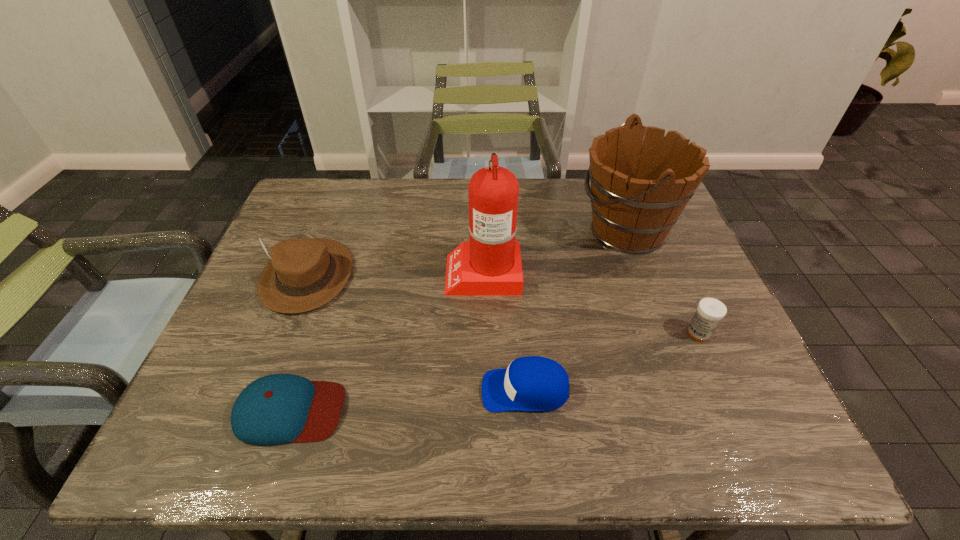
Locate an element on the screen. vacant space located 0.370m on the front-facing side of the fire extinguisher is located at coordinates (307, 272).

Find the location of a particular element. This screenshot has width=960, height=540. vacant space located 0.360m with the handle on the fifth shortest object is located at coordinates (454, 230).

Where is `free space located with the handle on the fifth shortest object`? This screenshot has height=540, width=960. free space located with the handle on the fifth shortest object is located at coordinates (556, 230).

Identify the location of free region located with the handle on the fifth shortest object. (518, 230).

In order to click on free space located on the feather side of the fedora in this screenshot , I will do `click(285, 333)`.

This screenshot has width=960, height=540. In order to click on free space located on the left of the medicine in this screenshot , I will do `click(528, 333)`.

Locate an element on the screen. The height and width of the screenshot is (540, 960). vacant space situated 0.390m on the front-facing side of the right baseball cap is located at coordinates (295, 390).

You are a GUI agent. You are given a task and a screenshot of the screen. Output one action in this format:
    pyautogui.click(x=<x>, y=<y>)
    Task: Click on the free spot located 0.270m on the front-facing side of the right baseball cap
    Image resolution: width=960 pixels, height=540 pixels.
    Given the screenshot: What is the action you would take?
    pyautogui.click(x=352, y=390)

Locate an element on the screen. This screenshot has width=960, height=540. vacant space located 0.200m on the front-facing side of the right baseball cap is located at coordinates (386, 390).

This screenshot has width=960, height=540. I want to click on vacant region located 0.340m with the bill of the shortest object facing forward, so click(513, 410).